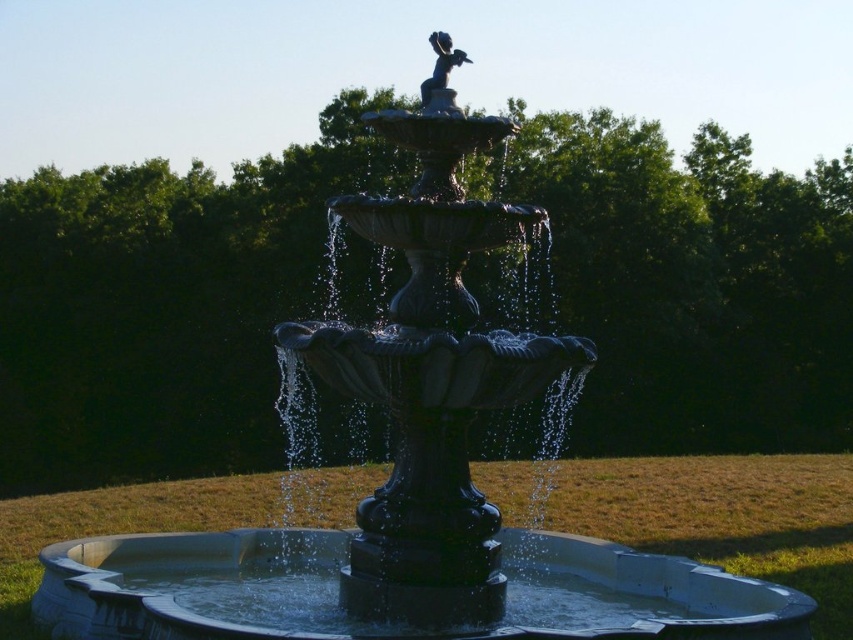
Question: Which point is closer to the camera taking this photo?

Choices:
 (A) (222, 572)
 (B) (422, 84)

Answer: (B)

Question: Which point appears farthest from the camera in this image?

Choices:
 (A) (434, 88)
 (B) (305, 586)

Answer: (B)

Question: Is glossy concrete basin at center above polished bronze statue at upper center?

Choices:
 (A) no
 (B) yes

Answer: (A)

Question: Is glossy concrete basin at center to the right of polished bronze statue at upper center from the viewer's perspective?

Choices:
 (A) yes
 (B) no

Answer: (A)

Question: Is glossy concrete basin at center to the left of polished bronze statue at upper center from the viewer's perspective?

Choices:
 (A) no
 (B) yes

Answer: (A)

Question: Among these objects, which one is farthest from the camera?

Choices:
 (A) polished bronze statue at upper center
 (B) glossy concrete basin at center

Answer: (B)